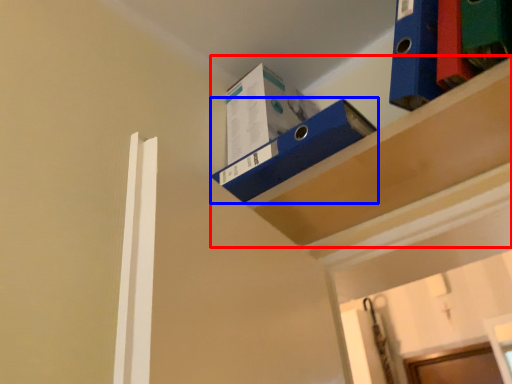
Question: Which object is further to the camera taking this photo, shelf (highlighted by a red box) or shelf (highlighted by a blue box)?

Choices:
 (A) shelf
 (B) shelf

Answer: (B)